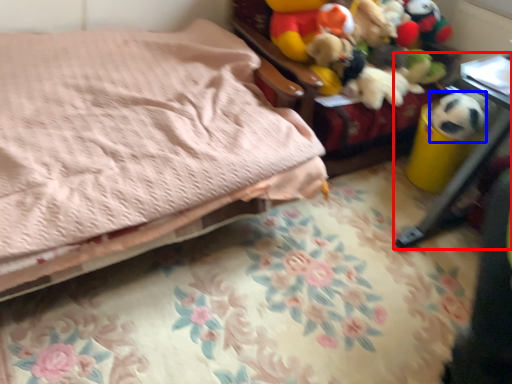
Question: Which object is further to the camera taking this photo, furniture (highlighted by a red box) or animal (highlighted by a blue box)?

Choices:
 (A) furniture
 (B) animal

Answer: (B)